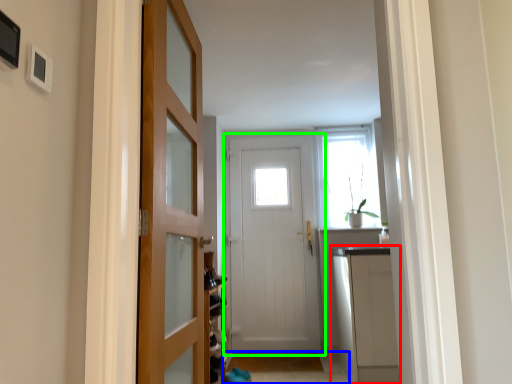
Question: Considering the real-world distances, which object is closest to cabinetry (highlighted by a red box)? path (highlighted by a blue box) or door (highlighted by a green box).

Choices:
 (A) path
 (B) door

Answer: (A)